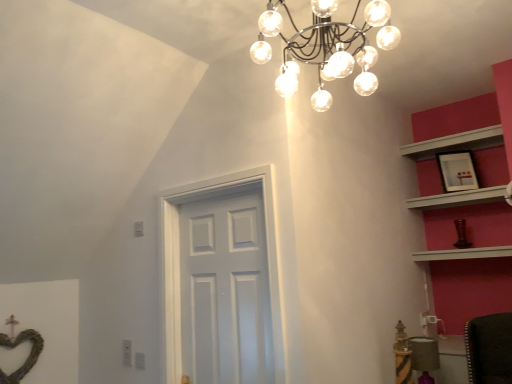
Question: Can you confirm if white glossy door at center is wider than matte black picture frame at upper right?

Choices:
 (A) yes
 (B) no

Answer: (A)

Question: Is the position of white glossy door at center less distant than that of matte black picture frame at upper right?

Choices:
 (A) no
 (B) yes

Answer: (B)

Question: Is white glossy door at center behind matte black picture frame at upper right?

Choices:
 (A) yes
 (B) no

Answer: (B)

Question: Can you confirm if white glossy door at center is bigger than matte black picture frame at upper right?

Choices:
 (A) yes
 (B) no

Answer: (A)

Question: Is white glossy door at center shorter than matte black picture frame at upper right?

Choices:
 (A) no
 (B) yes

Answer: (A)

Question: Considering the positions of matte black picture frame at upper right and white wooden shelf at upper right, positioned as the 1th shelf in bottom-to-top order, in the image, is matte black picture frame at upper right wider or thinner than white wooden shelf at upper right, positioned as the 1th shelf in bottom-to-top order,?

Choices:
 (A) wide
 (B) thin

Answer: (B)

Question: From a real-world perspective, is matte black picture frame at upper right physically located above or below white wooden shelf at upper right, the second shelf positioned from the top?

Choices:
 (A) below
 (B) above

Answer: (B)

Question: Would you say matte black picture frame at upper right is inside or outside white wooden shelf at upper right, positioned as the 1th shelf in bottom-to-top order?

Choices:
 (A) outside
 (B) inside

Answer: (A)

Question: Relative to white wooden shelf at upper right, the second shelf positioned from the top, is matte black picture frame at upper right in front or behind?

Choices:
 (A) behind
 (B) front

Answer: (A)

Question: From their relative heights in the image, would you say white wooden shelf at upper right, the second shelf positioned from the top, is taller or shorter than matte black picture frame at upper right?

Choices:
 (A) tall
 (B) short

Answer: (B)

Question: Would you say white wooden shelf at upper right, the second shelf positioned from the top, is inside or outside matte black picture frame at upper right?

Choices:
 (A) outside
 (B) inside

Answer: (A)

Question: Looking at their shapes, would you say white wooden shelf at upper right, positioned as the 1th shelf in bottom-to-top order, is wider or thinner than matte black picture frame at upper right?

Choices:
 (A) thin
 (B) wide

Answer: (B)

Question: Does point (406, 203) appear closer or farther from the camera than point (460, 173)?

Choices:
 (A) closer
 (B) farther

Answer: (B)

Question: Is matte black picture frame at upper right spatially inside velvet purple chair at lower right, or outside of it?

Choices:
 (A) inside
 (B) outside

Answer: (B)

Question: From the image's perspective, relative to velvet purple chair at lower right, is matte black picture frame at upper right above or below?

Choices:
 (A) below
 (B) above

Answer: (B)